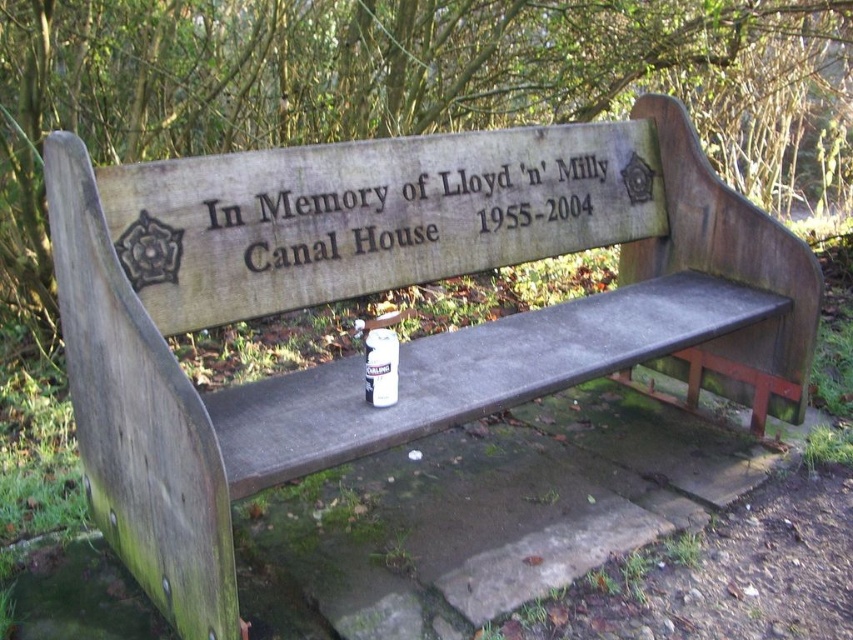
Question: Can you confirm if black engraved text at center is positioned above white matte can at center?

Choices:
 (A) yes
 (B) no

Answer: (A)

Question: Can you confirm if black engraved text at center is bigger than white matte can at center?

Choices:
 (A) no
 (B) yes

Answer: (B)

Question: Is black engraved text at center to the left of white matte can at center from the viewer's perspective?

Choices:
 (A) yes
 (B) no

Answer: (B)